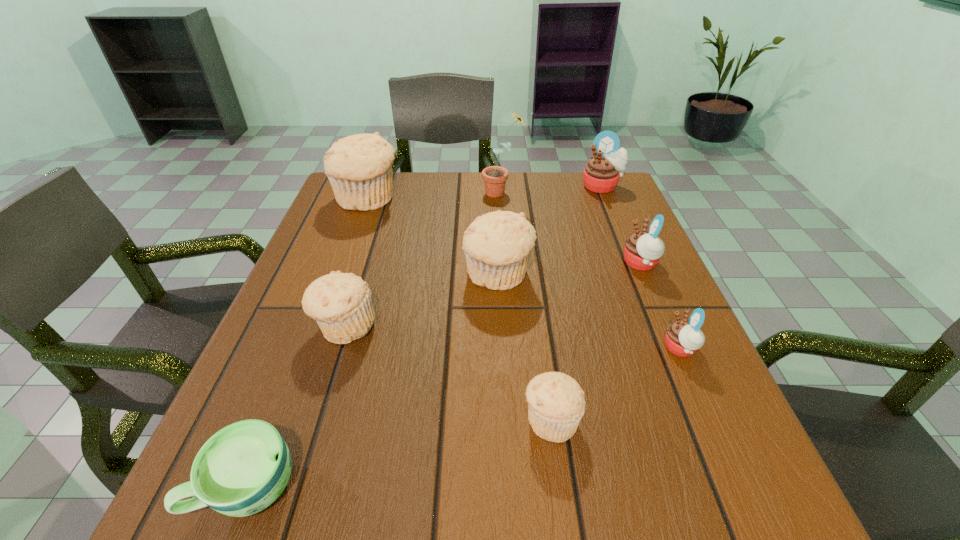
This screenshot has height=540, width=960. What are the coordinates of `the nearest object` in the screenshot? It's located at (243, 468).

The height and width of the screenshot is (540, 960). Find the location of `vacant point located 0.380m on the flower of the tallest object`. vacant point located 0.380m on the flower of the tallest object is located at coordinates (342, 192).

Find the location of a particular element. Image resolution: width=960 pixels, height=540 pixels. vacant space located 0.110m on the flower of the tallest object is located at coordinates (442, 192).

Identify the location of free space located 0.330m on the flower of the tallest object. The image size is (960, 540). click(360, 192).

Find the location of a particular element. vacant space situated 0.050m on the right of the biggest beige muffin is located at coordinates (420, 199).

The width and height of the screenshot is (960, 540). In order to click on free location located on the front-facing side of the biggest pink muffin in this screenshot , I will do `click(618, 225)`.

Find the location of a particular element. This screenshot has height=540, width=960. vacant area situated on the left of the third nearest beige muffin is located at coordinates (421, 275).

Where is `vacant space positioned 0.080m on the front-facing side of the second farthest pink muffin`? The image size is (960, 540). vacant space positioned 0.080m on the front-facing side of the second farthest pink muffin is located at coordinates click(586, 264).

In order to click on free space located 0.090m on the front-facing side of the second farthest pink muffin in this screenshot , I will do `click(581, 264)`.

I want to click on vacant space situated on the front-facing side of the second farthest pink muffin, so click(x=590, y=264).